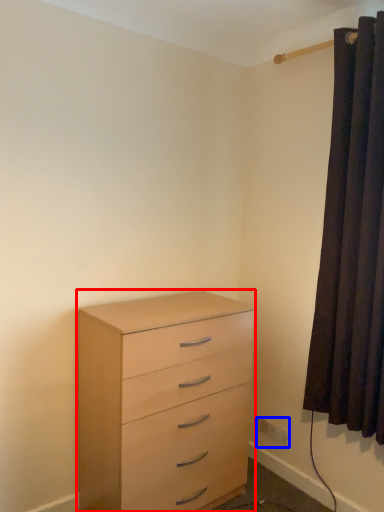
Question: Which of the following is the closest to the observer, chest of drawers (highlighted by a red box) or electric outlet (highlighted by a blue box)?

Choices:
 (A) chest of drawers
 (B) electric outlet

Answer: (A)